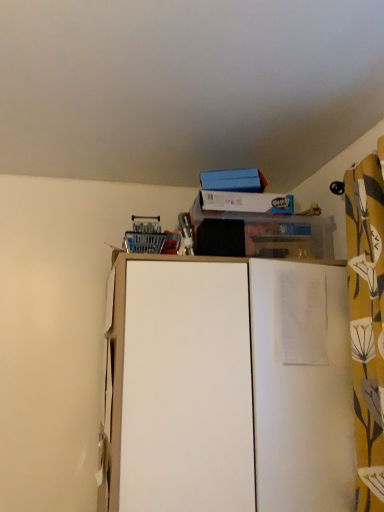
This screenshot has height=512, width=384. Identify the location of white matte cabinet at center. (226, 387).

What do you see at coordinates (226, 387) in the screenshot? The width and height of the screenshot is (384, 512). I see `white matte cabinet at center` at bounding box center [226, 387].

What are the coordinates of `white matte cabinet at center` in the screenshot? It's located at (226, 387).